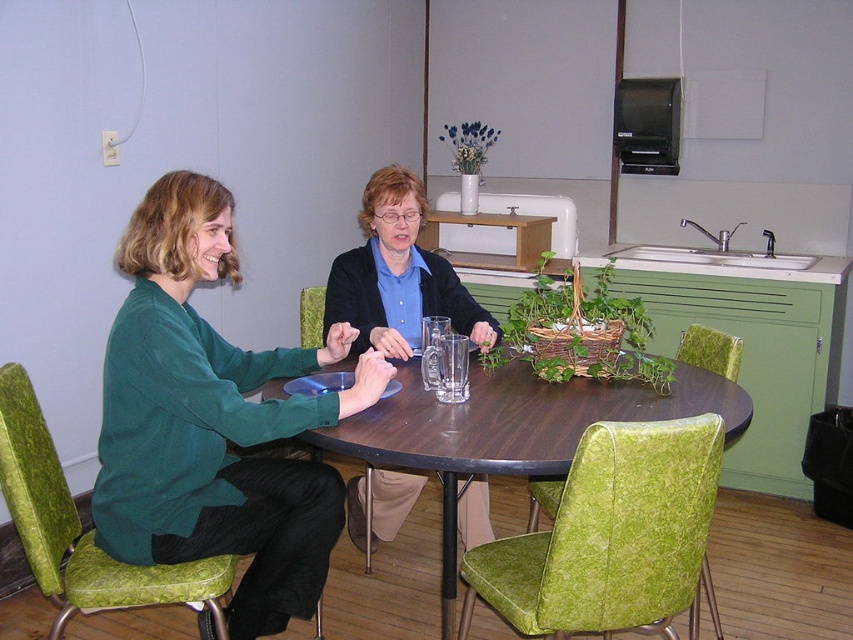
You are planning to place a new decorative item on the wooden table at center and the matte black sweater at center. Considering their sizes, which surface can accommodate a larger item?

The wooden table at center has a larger size compared to the matte black sweater at center, so it can accommodate a larger decorative item.

You are a delivery person who needs to place a small package on the surface of the wooden table at center. However, there is a matte black sweater at center on the table. Can you place the package directly on top of the sweater without it hanging off the edge?

The wooden table at center has a greater height compared to matte black sweater at center, so yes, the package can be placed directly on top of the matte black sweater at center without any issues as the table provides enough surface area.

You are a guest entering the room and want to sit down at the wooden table at center. The matte black sweater at center is currently on the chair you want to sit on. Can you sit there without moving the sweater?

The wooden table at center is in front of the matte black sweater at center, which means the sweater is likely on the chair behind the table. Since the sweater is on the chair, you would need to move it to sit down.